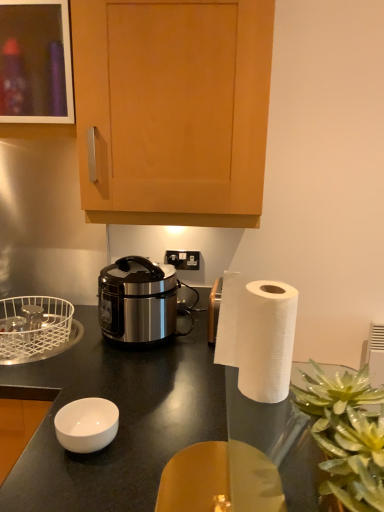
This screenshot has width=384, height=512. Identify the location of vacant space to the right of white glossy bowl at lower left. (154, 442).